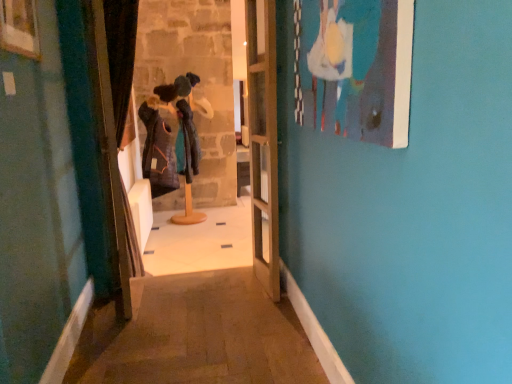
Question: Should I look upward or downward to see clear glass door at center?

Choices:
 (A) down
 (B) up

Answer: (B)

Question: Can you confirm if matte blue painting at upper right, the 1th picture frame viewed from the right, is taller than velvet dark brown curtain at left?

Choices:
 (A) yes
 (B) no

Answer: (B)

Question: Does matte blue painting at upper right, which appears as the second picture frame when viewed from the left, appear on the right side of velvet dark brown curtain at left?

Choices:
 (A) yes
 (B) no

Answer: (A)

Question: Is matte blue painting at upper right, which appears as the second picture frame when viewed from the left, looking in the opposite direction of velvet dark brown curtain at left?

Choices:
 (A) yes
 (B) no

Answer: (B)

Question: Can velvet dark brown curtain at left be found inside matte blue painting at upper right, the 1th picture frame viewed from the right?

Choices:
 (A) no
 (B) yes

Answer: (A)

Question: Is matte blue painting at upper right, the 1th picture frame viewed from the right, smaller than velvet dark brown curtain at left?

Choices:
 (A) no
 (B) yes

Answer: (B)

Question: From a real-world perspective, does matte blue painting at upper right, which appears as the second picture frame when viewed from the left, stand above velvet dark brown curtain at left?

Choices:
 (A) no
 (B) yes

Answer: (B)

Question: Is velvet dark brown curtain at left shorter than clear glass door at center?

Choices:
 (A) yes
 (B) no

Answer: (A)

Question: Is velvet dark brown curtain at left not inside clear glass door at center?

Choices:
 (A) yes
 (B) no

Answer: (A)

Question: From the image's perspective, does velvet dark brown curtain at left appear lower than clear glass door at center?

Choices:
 (A) yes
 (B) no

Answer: (A)

Question: Are velvet dark brown curtain at left and clear glass door at center far apart?

Choices:
 (A) no
 (B) yes

Answer: (A)

Question: Is velvet dark brown curtain at left closer to camera compared to clear glass door at center?

Choices:
 (A) yes
 (B) no

Answer: (A)

Question: From the image's perspective, is velvet dark brown curtain at left above clear glass door at center?

Choices:
 (A) yes
 (B) no

Answer: (B)

Question: Is wooden picture frame at upper left, acting as the 1th picture frame starting from the left, not near velvet dark brown curtain at left?

Choices:
 (A) yes
 (B) no

Answer: (B)